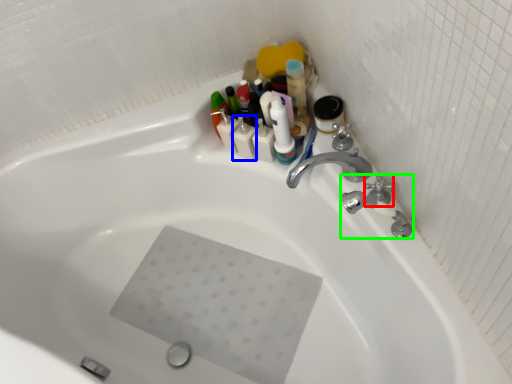
Question: Which is farther away from plumbing fixture (highlighted by a red box)? toiletry (highlighted by a blue box) or plumbing fixture (highlighted by a green box)?

Choices:
 (A) toiletry
 (B) plumbing fixture

Answer: (A)